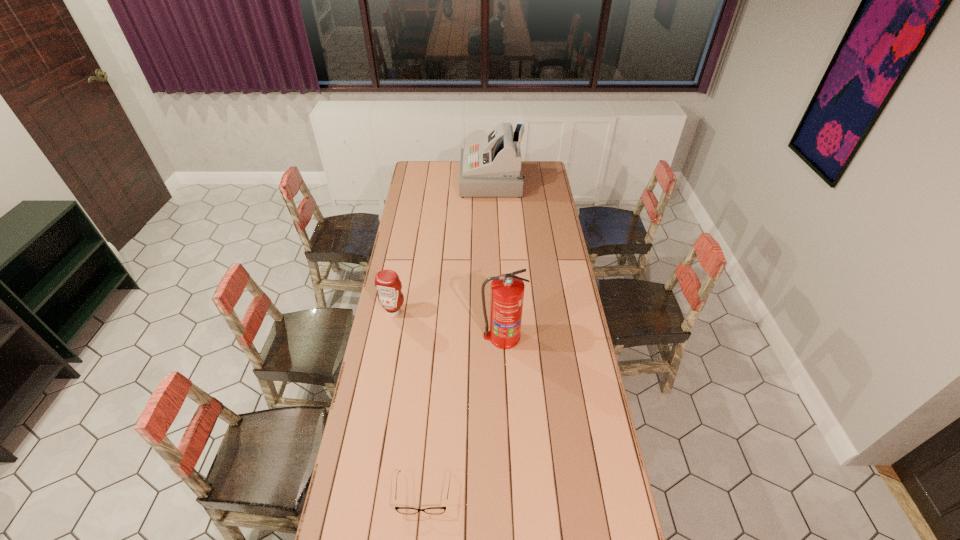
The height and width of the screenshot is (540, 960). In order to click on free space located on the back of the condiment in this screenshot , I will do `click(402, 267)`.

Find the location of a particular element. object that is at the far edge is located at coordinates (492, 167).

What are the coordinates of `object that is at the left edge` in the screenshot? It's located at (387, 282).

This screenshot has width=960, height=540. I want to click on free space at the far edge of the desktop, so click(x=454, y=178).

The image size is (960, 540). What are the coordinates of `vacant space at the left edge` in the screenshot? It's located at (427, 231).

Where is `free space at the right edge of the desktop`? This screenshot has height=540, width=960. free space at the right edge of the desktop is located at coordinates (540, 195).

Image resolution: width=960 pixels, height=540 pixels. Find the location of `free space between the nearest object and the cash register`. free space between the nearest object and the cash register is located at coordinates (458, 336).

Find the location of a particular element. This screenshot has width=960, height=540. free spot between the cash register and the fire extinguisher is located at coordinates (497, 259).

You are a GUI agent. You are given a task and a screenshot of the screen. Output one action in this format:
    pyautogui.click(x=<x>, y=<y>)
    Task: Click on the vacant region between the farthest object and the third farthest object
    The image size is (960, 540).
    Given the screenshot: What is the action you would take?
    pyautogui.click(x=497, y=259)

Identify the location of empty space that is in between the nearest object and the leftmost object. (409, 402).